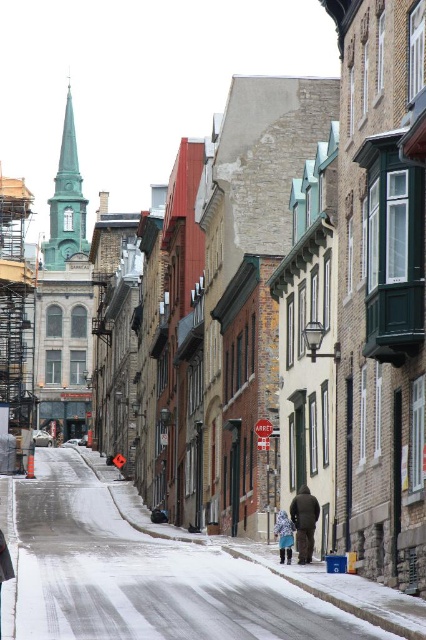
Question: Which object appears closest to the camera in this image?

Choices:
 (A) blue denim jacket at lower center
 (B) green glass spire at upper left
 (C) white snow at center
 (D) dark brown leather jacket at center

Answer: (C)

Question: Which point is farther to the camera?

Choices:
 (A) (282, 515)
 (B) (304, 515)

Answer: (A)

Question: Does green glass spire at upper left have a smaller size compared to blue denim jacket at lower center?

Choices:
 (A) yes
 (B) no

Answer: (B)

Question: Can you confirm if white snow at center is positioned to the left of green glass spire at upper left?

Choices:
 (A) yes
 (B) no

Answer: (B)

Question: Is green glass spire at upper left smaller than blue denim jacket at lower center?

Choices:
 (A) no
 (B) yes

Answer: (A)

Question: Which of the following is the closest to the observer?

Choices:
 (A) (71, 243)
 (B) (117, 572)

Answer: (B)